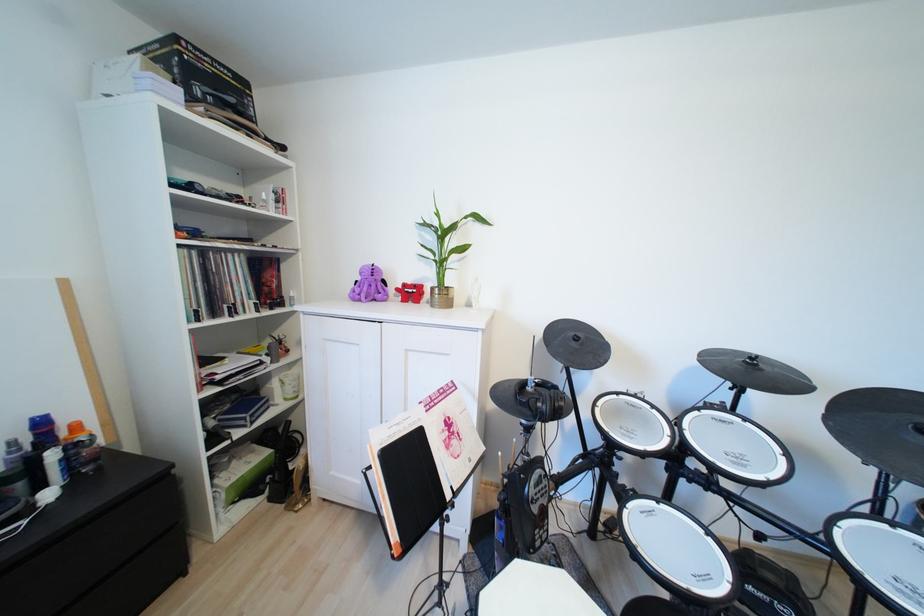
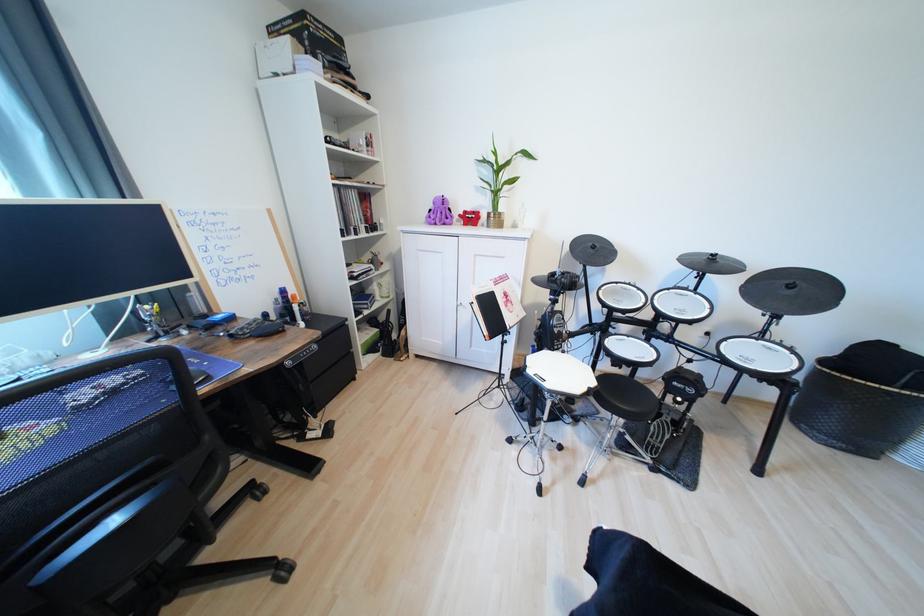
Question: I am providing you with two images of the same scene from different viewpoints. After the viewpoint changes to image2, which objects are now occluded?

Choices:
 (A) red blocky toy
 (B) music booklet
 (C) black cymbal pad
 (D) none of these

Answer: (D)